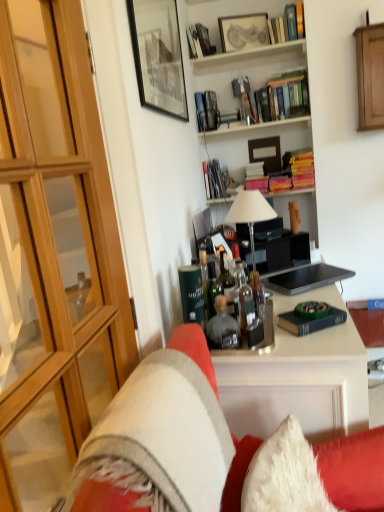
The height and width of the screenshot is (512, 384). Identify the location of free space above hardcover book at center, the 1th book when ordered from front to back (from a real-world perspective). (309, 314).